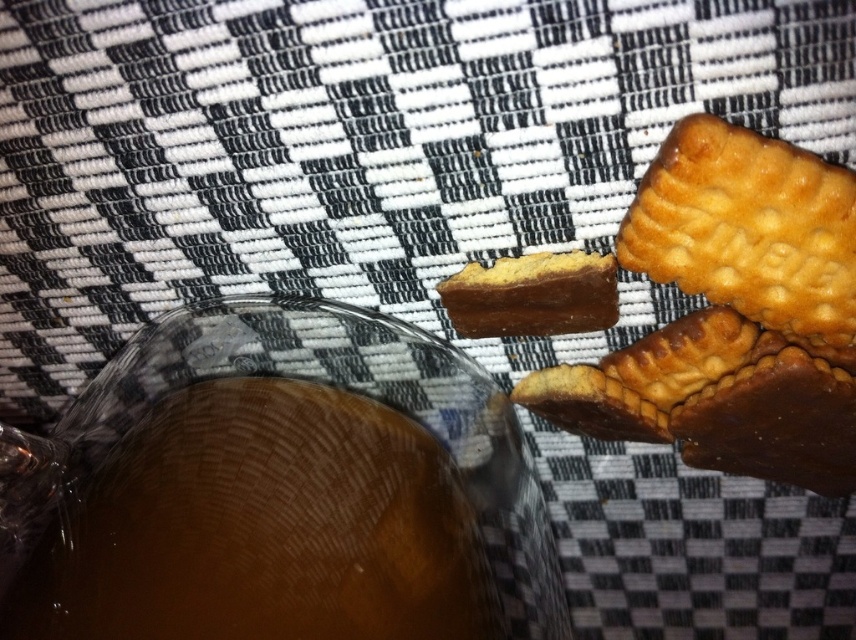
You are looking at the image and want to place a small sticker exactly halfway between the two points, point (699,134) and point (605,278). Since the sticker is very small, you can ignore the depth difference between the two points. Will the sticker be closer to the glass or the cookies?

The sticker placed halfway between point (699,134) and point (605,278) will be closer to the glass because the point (699,134) is closer to the viewer than point (605,278), so the midpoint will lean towards the glass side.